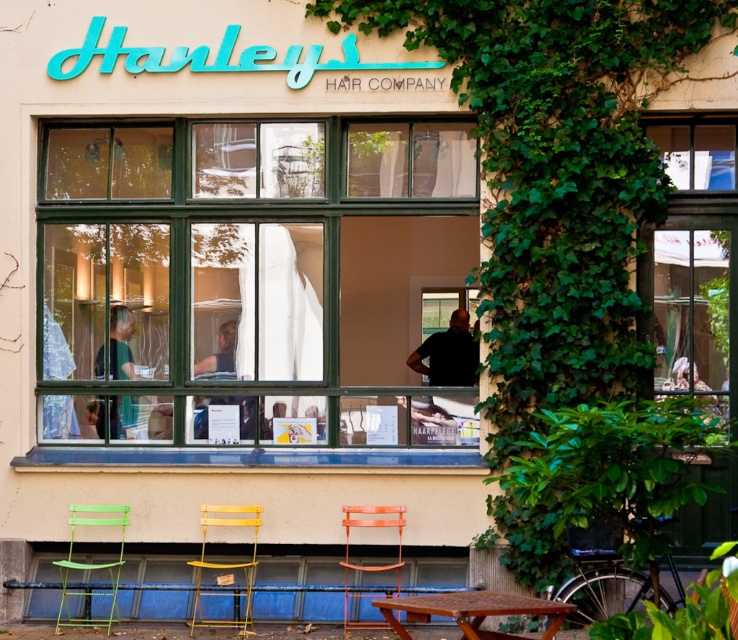
Does rustic wooden table at lower center come behind yellow metal chair at center?

No.

Is point (472, 595) in front of point (255, 509)?

Yes.

Does point (568, 609) lie behind point (210, 524)?

No, (568, 609) is in front of (210, 524).

Locate an element on the screen. The height and width of the screenshot is (640, 738). rustic wooden table at lower center is located at coordinates (472, 611).

Is point (123, 352) more distant than point (348, 595)?

Yes, it is.

Between green fabric shirt at left and orange plastic chair at center, which one is positioned lower?

Positioned lower is orange plastic chair at center.

Is point (141, 371) closer to camera compared to point (351, 563)?

No, it is not.

You are a GUI agent. You are given a task and a screenshot of the screen. Output one action in this format:
    pyautogui.click(x=<x>, y=<y>)
    Task: Click on the green fabric shirt at left
    This screenshot has height=640, width=738.
    Given the screenshot: What is the action you would take?
    tap(120, 348)

Looking at this image, is yellow metal chair at center taller than black matte shirt at center?

Yes, yellow metal chair at center is taller than black matte shirt at center.

Between yellow metal chair at center and black matte shirt at center, which one appears on the left side from the viewer's perspective?

From the viewer's perspective, yellow metal chair at center appears more on the left side.

At what (x,y) coordinates should I click in order to perform the action: click on yellow metal chair at center. Please return your answer as a coordinate pair (x, y). Looking at the image, I should click on (224, 566).